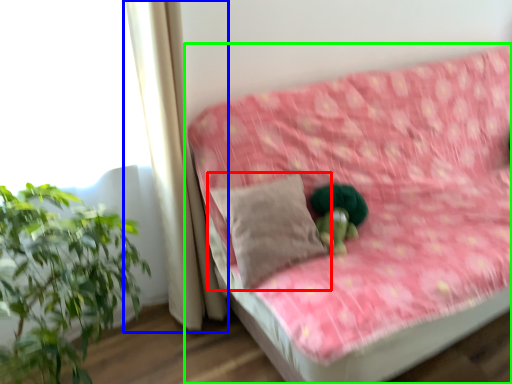
Question: Estimate the real-world distances between objects in this image. Which object is farther from pillow (highlighted by a red box), curtain (highlighted by a blue box) or studio couch (highlighted by a green box)?

Choices:
 (A) curtain
 (B) studio couch

Answer: (B)